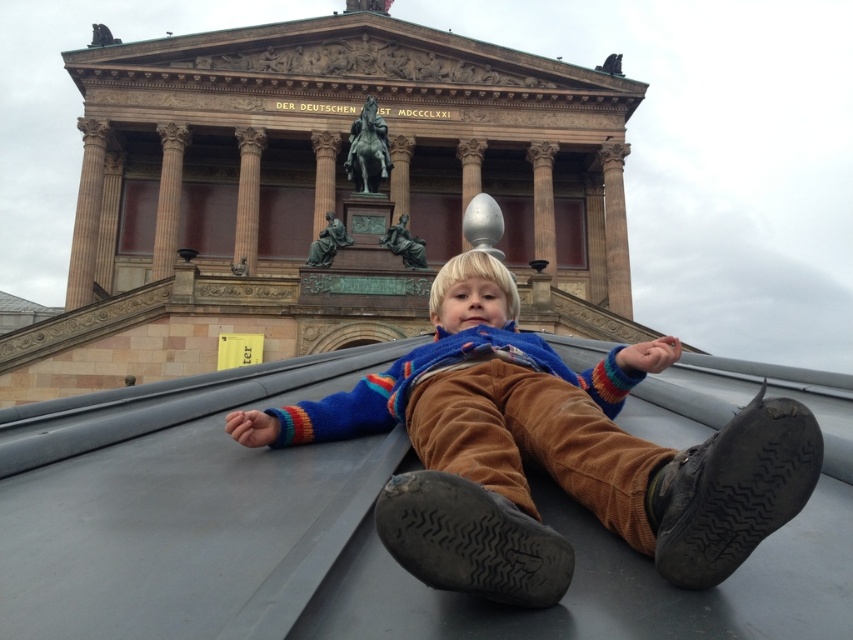
Question: Is smooth stone column at upper left wider than brown polished stone column at center?

Choices:
 (A) yes
 (B) no

Answer: (B)

Question: Is brown corduroy pants at center positioned before smooth stone column at upper left?

Choices:
 (A) yes
 (B) no

Answer: (A)

Question: Which is nearer to the satin gold column at center?

Choices:
 (A) brown polished stone column at center
 (B) polished stone column at upper center
 (C) brown corduroy pants at center

Answer: (A)

Question: Which object is positioned closest to the brown polished stone column at center?

Choices:
 (A) brown stone pillar at center
 (B) brown corduroy pants at center
 (C) polished stone column at upper center

Answer: (C)

Question: Which object appears farthest from the camera in this image?

Choices:
 (A) brown stone pillar at center
 (B) smooth stone column at upper left
 (C) brown corduroy pants at center
 (D) satin gold column at center

Answer: (D)

Question: Does smooth stone column at upper left appear under brown stone pillar at center?

Choices:
 (A) no
 (B) yes

Answer: (A)